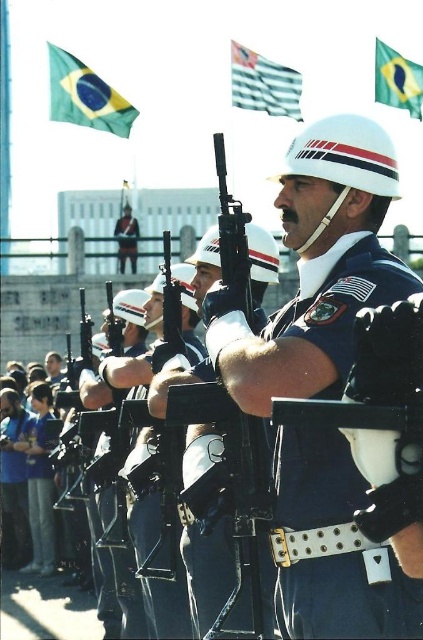
Question: Can you confirm if blue fabric uniform at lower left is wider than green and yellow fabric flag at upper right?

Choices:
 (A) yes
 (B) no

Answer: (B)

Question: Based on their relative distances, which object is farther from the blue fabric belt at center?

Choices:
 (A) white matte helmet at upper center
 (B) blue fabric shirt at lower left
 (C) blue fabric uniform at lower left

Answer: (A)

Question: Which point appears farthest from the camera in this image?

Choices:
 (A) (238, 54)
 (B) (8, 476)
 (C) (398, 76)

Answer: (C)

Question: Among these objects, which one is nearest to the camera?

Choices:
 (A) blue fabric uniform at lower left
 (B) green fabric flag at upper left
 (C) white striped flag at upper center

Answer: (A)

Question: Does blue fabric belt at center lie in front of white matte helmet at upper center?

Choices:
 (A) no
 (B) yes

Answer: (B)

Question: Can you confirm if blue fabric uniform at lower left is positioned below white striped flag at upper center?

Choices:
 (A) no
 (B) yes

Answer: (B)